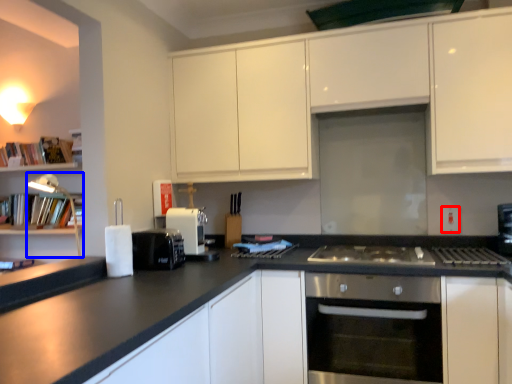
Question: Among these objects, which one is nearest to the camera, electric outlet (highlighted by a red box) or lamp (highlighted by a blue box)?

Choices:
 (A) electric outlet
 (B) lamp

Answer: (B)